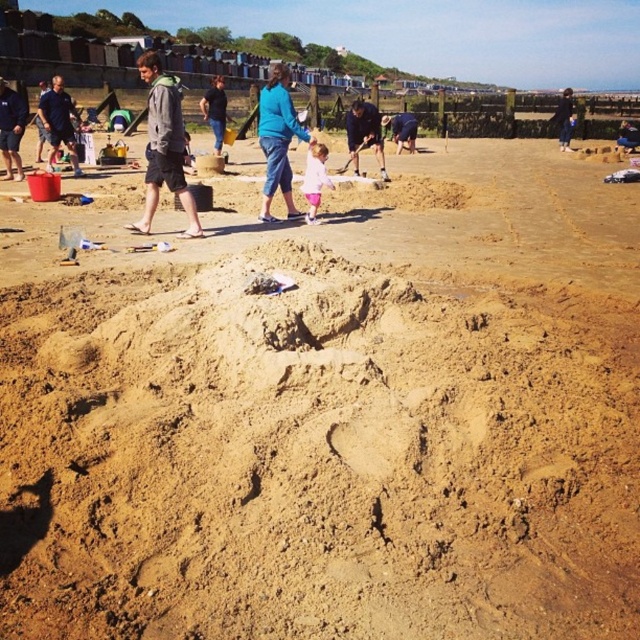
Question: Which point is farther to the camera?

Choices:
 (A) (625, 125)
 (B) (22, 102)

Answer: (A)

Question: Which of the following is the closest to the observer?

Choices:
 (A) smooth sandcastle at center
 (B) dark blue hoodie at upper center
 (C) blue fabric pants at center

Answer: (C)

Question: Does dark blue shirt at left have a lesser width compared to dark blue shorts at left?

Choices:
 (A) no
 (B) yes

Answer: (A)

Question: Among these points, which one is nearest to the camera?

Choices:
 (A) (209, 100)
 (B) (410, 122)
 (C) (305, 180)
 (D) (44, 138)

Answer: (C)

Question: Is dark blue shorts at left thinner than dark blue hoodie at upper center?

Choices:
 (A) yes
 (B) no

Answer: (A)

Question: Is gray hoodie at left in front of blue denim jeans at center?

Choices:
 (A) yes
 (B) no

Answer: (A)